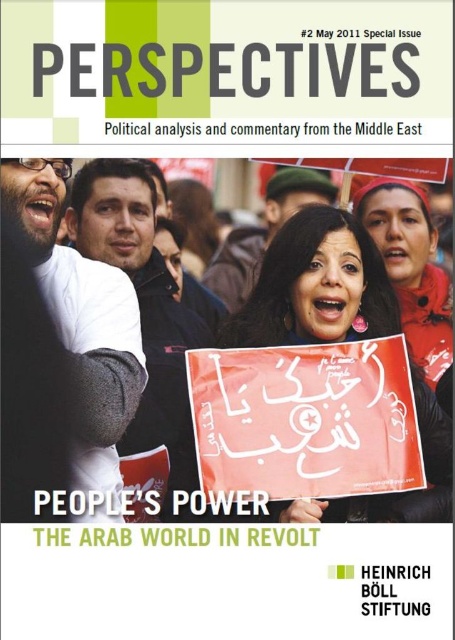
Question: Considering the relative positions of red matte sign at center and matte red scarf at upper right in the image provided, where is red matte sign at center located with respect to matte red scarf at upper right?

Choices:
 (A) right
 (B) left

Answer: (B)

Question: Which point appears farthest from the camera in this image?

Choices:
 (A) (337, 243)
 (B) (445, 320)

Answer: (B)

Question: Does red matte sign at center appear on the left side of matte red scarf at upper right?

Choices:
 (A) no
 (B) yes

Answer: (B)

Question: Which point is closer to the camera?

Choices:
 (A) (409, 289)
 (B) (301, 262)

Answer: (B)

Question: Can you confirm if red matte sign at center is bigger than matte red scarf at upper right?

Choices:
 (A) yes
 (B) no

Answer: (A)